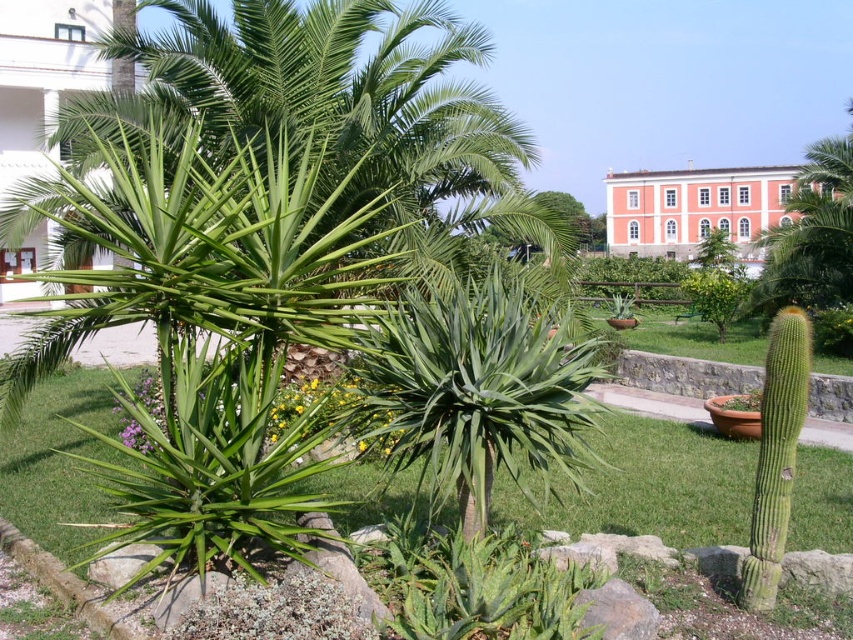
You are standing in the garden and want to take a photo of both the green leafy palm tree at center and the pink stucco building at upper center. Which object should you position to your left side in the camera frame to capture both in the same shot?

To capture both the green leafy palm tree at center and the pink stucco building at upper center in the same photo, you should position the green leafy palm tree at center to your left side in the camera frame since it is located to the left of the pink stucco building at upper center.

You are standing in the garden and want to take a closer look at the green leafy palm tree at center. If your camera can focus on objects up to 4 meters away, will it be able to capture the palm tree clearly?

The green leafy palm tree at center is 4.18 meters away from the camera, which is beyond the 4 meter focusing range. Therefore, the camera may not capture it clearly.

You are designing a garden layout and need to place a new bench that requires 3 meters of space. You see the green leafy palm tree at center and the pink stucco building at upper center. Which object has a narrower width, making it a better candidate for placing the bench next to?

The green leafy palm tree at center has a lesser width compared to the pink stucco building at upper center, so it would be the better candidate for placing the bench next to as it requires less space.